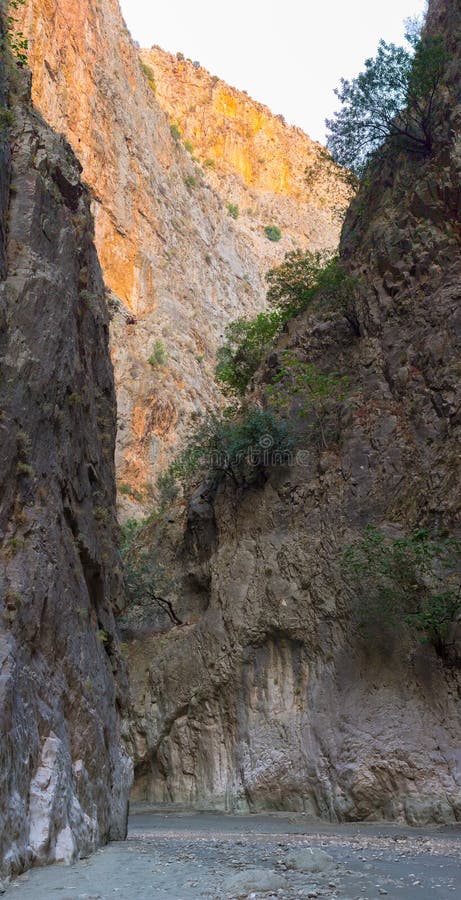
This screenshot has width=461, height=900. Identify the location of walls. (254, 601).